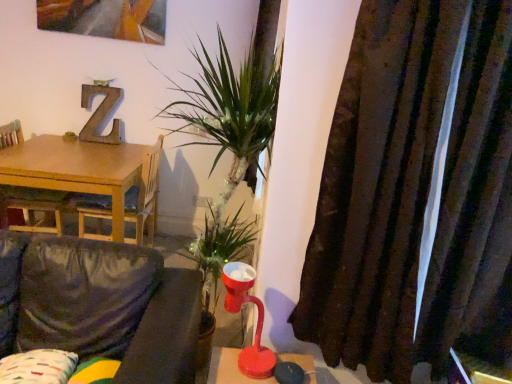
Question: Considering the relative sizes of wooden table at left and matte red table lamp at center in the image provided, is wooden table at left smaller than matte red table lamp at center?

Choices:
 (A) no
 (B) yes

Answer: (A)

Question: From a real-world perspective, does wooden table at left stand above matte red table lamp at center?

Choices:
 (A) no
 (B) yes

Answer: (A)

Question: Can you confirm if wooden table at left is thinner than matte red table lamp at center?

Choices:
 (A) no
 (B) yes

Answer: (A)

Question: Considering the relative sizes of wooden table at left and matte red table lamp at center in the image provided, is wooden table at left wider than matte red table lamp at center?

Choices:
 (A) no
 (B) yes

Answer: (B)

Question: Is matte red table lamp at center inside wooden table at left?

Choices:
 (A) yes
 (B) no

Answer: (B)

Question: Is wooden table at left located outside matte red table lamp at center?

Choices:
 (A) yes
 (B) no

Answer: (A)

Question: Is wooden table at left looking in the opposite direction of velvet dark grey couch at lower left?

Choices:
 (A) no
 (B) yes

Answer: (A)

Question: Would you say velvet dark grey couch at lower left is part of wooden table at left's contents?

Choices:
 (A) no
 (B) yes

Answer: (A)

Question: From the image's perspective, would you say wooden table at left is positioned over velvet dark grey couch at lower left?

Choices:
 (A) no
 (B) yes

Answer: (B)

Question: Could you tell me if wooden table at left is facing velvet dark grey couch at lower left?

Choices:
 (A) no
 (B) yes

Answer: (B)

Question: Considering the relative sizes of wooden table at left and velvet dark grey couch at lower left in the image provided, is wooden table at left smaller than velvet dark grey couch at lower left?

Choices:
 (A) no
 (B) yes

Answer: (A)

Question: Is wooden table at left completely or partially outside of velvet dark grey couch at lower left?

Choices:
 (A) yes
 (B) no

Answer: (A)

Question: Are velvet dark grey couch at lower left and brown textured curtain at right far apart?

Choices:
 (A) yes
 (B) no

Answer: (B)